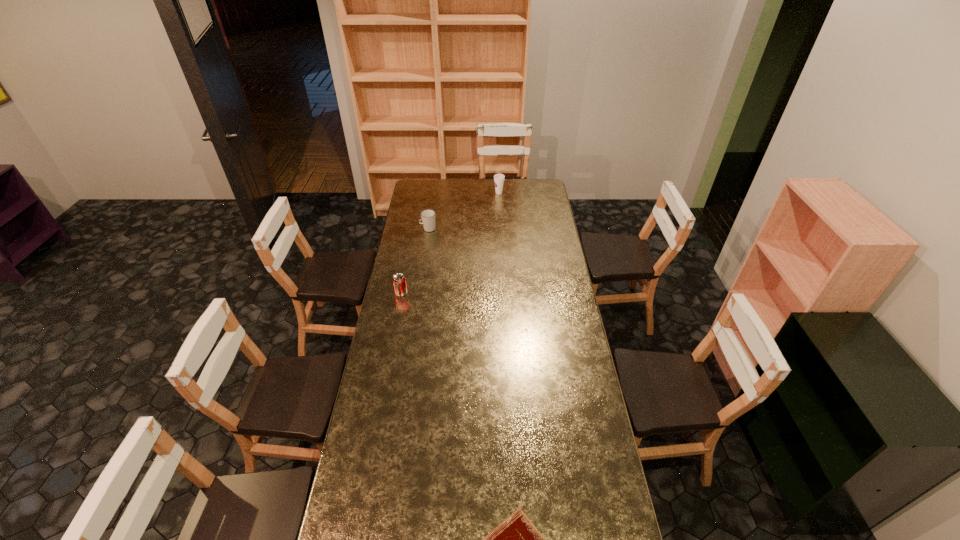
Find the location of a particular element. The width and height of the screenshot is (960, 540). the farther cup is located at coordinates (498, 178).

Find the location of a particular element. Image resolution: width=960 pixels, height=540 pixels. the farthest object is located at coordinates (498, 178).

At what (x,y) coordinates should I click in order to perform the action: click on the left cup. Please return your answer as a coordinate pair (x, y). The width and height of the screenshot is (960, 540). Looking at the image, I should click on (427, 216).

Where is `the second farthest object`? Image resolution: width=960 pixels, height=540 pixels. the second farthest object is located at coordinates (427, 216).

Image resolution: width=960 pixels, height=540 pixels. Find the location of `the leftmost object`. the leftmost object is located at coordinates (399, 281).

I want to click on soda can, so click(399, 281).

Locate an element on the screen. free region located 0.150m on the left of the farthest object is located at coordinates (470, 193).

Where is `vacant area located with a handle on the side of the second object from left to right`? vacant area located with a handle on the side of the second object from left to right is located at coordinates (411, 229).

Where is `free location located with a handle on the side of the second object from left to right`? free location located with a handle on the side of the second object from left to right is located at coordinates (408, 229).

I want to click on vacant space located 0.080m with a handle on the side of the second object from left to right, so click(x=406, y=229).